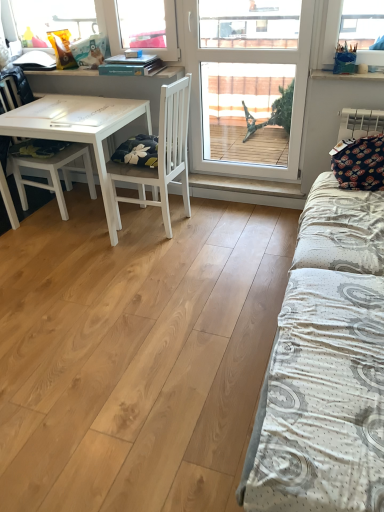
Question: Considering the relative positions of transparent glass window at center and white plastic bag at upper right in the image provided, is transparent glass window at center to the left or to the right of white plastic bag at upper right?

Choices:
 (A) left
 (B) right

Answer: (A)

Question: From the image's perspective, relative to white plastic bag at upper right, is transparent glass window at center above or below?

Choices:
 (A) below
 (B) above

Answer: (A)

Question: Which object is the closest to the white matte chair at center, which ranks as the 2th chair in left-to-right order?

Choices:
 (A) white matte table at left
 (B) white textured bed at right
 (C) white plastic bag at upper right
 (D) transparent glass window at center
 (E) dark blue fabric pillow at right

Answer: (A)

Question: Which of these objects is positioned closest to the dark blue fabric pillow at right?

Choices:
 (A) white textured bed at right
 (B) white matte chair at left, which is counted as the 1th chair, starting from the left
 (C) white plastic bag at upper right
 (D) white matte table at left
 (E) transparent glass window at center

Answer: (C)